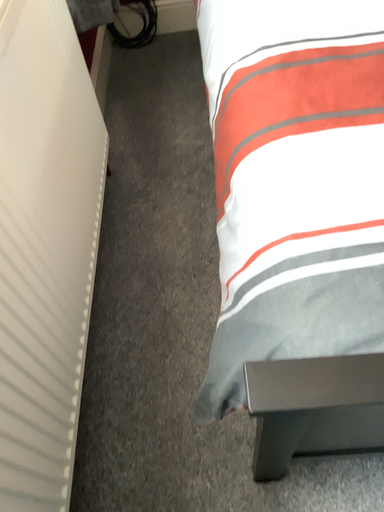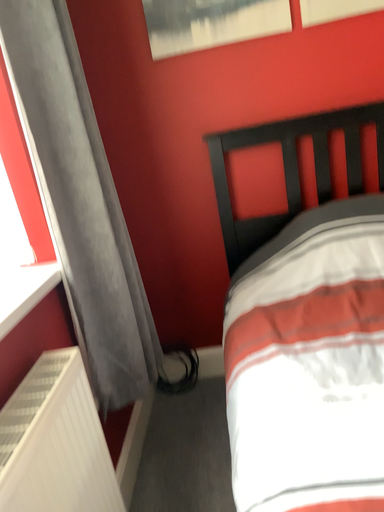
Question: How did the camera likely rotate when shooting the video?

Choices:
 (A) rotated downward
 (B) rotated upward

Answer: (B)